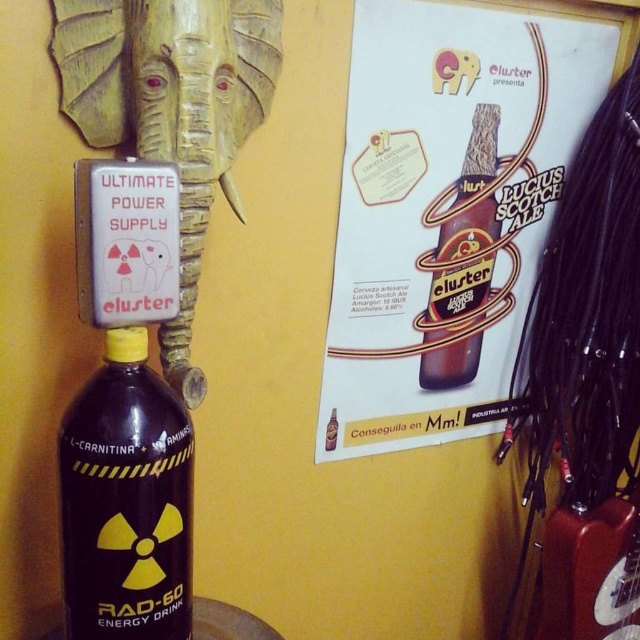
Which is above, matte paper poster at upper right or black matte bottle at lower left?

matte paper poster at upper right

Does point (392, 120) lie behind point (99, 461)?

Yes, it is.

What do you see at coordinates (445, 211) in the screenshot?
I see `matte paper poster at upper right` at bounding box center [445, 211].

The height and width of the screenshot is (640, 640). I want to click on matte paper poster at upper right, so click(x=445, y=211).

Is wooden elephant head at upper left closer to the viewer compared to black matte bottle at lower left?

No, it is not.

Is wooden elephant head at upper left taller than black matte bottle at lower left?

Correct, wooden elephant head at upper left is much taller as black matte bottle at lower left.

Consider the image. Who is more distant from viewer, (250, 29) or (83, 538)?

The point (250, 29) is behind.

At what (x,y) coordinates should I click in order to perform the action: click on wooden elephant head at upper left. Please return your answer as a coordinate pair (x, y). The image size is (640, 640). Looking at the image, I should click on (172, 109).

Does wooden elephant head at upper left have a smaller size compared to brown glass bottle at upper center?

No.

Can you confirm if wooden elephant head at upper left is wider than brown glass bottle at upper center?

Indeed, wooden elephant head at upper left has a greater width compared to brown glass bottle at upper center.

Which is in front, point (109, 17) or point (456, 353)?

Point (109, 17) is in front.

At what (x,y) coordinates should I click in order to perform the action: click on wooden elephant head at upper left. Please return your answer as a coordinate pair (x, y). Looking at the image, I should click on (172, 109).